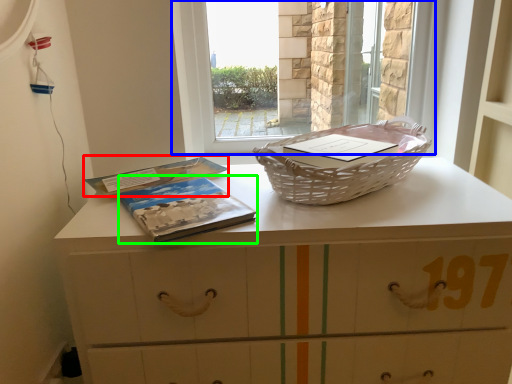
Question: Which object is positioned closest to paperback book (highlighted by a red box)? Select from window (highlighted by a blue box) and paperback book (highlighted by a green box).

Choices:
 (A) window
 (B) paperback book

Answer: (B)